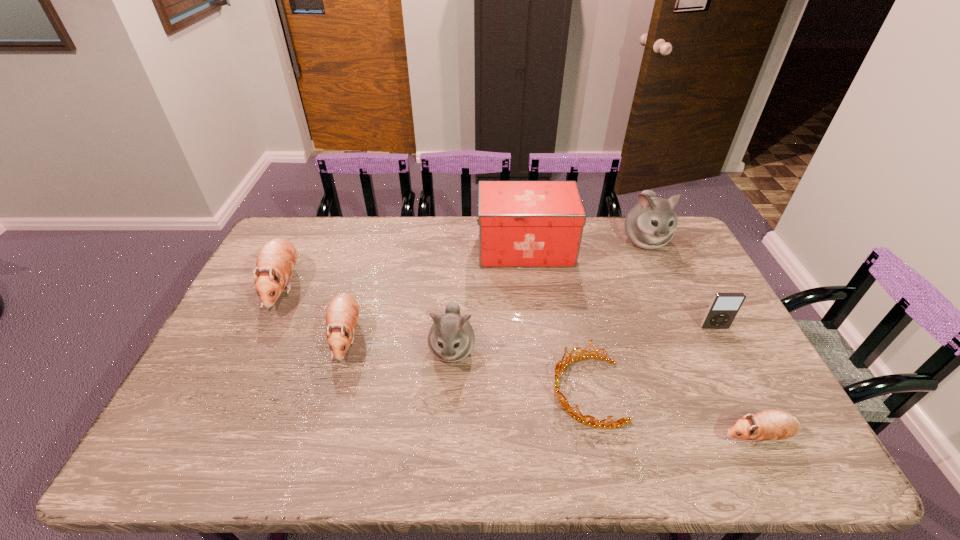
Where is `unoccupied area between the tiara and the farther white hamster`? The image size is (960, 540). unoccupied area between the tiara and the farther white hamster is located at coordinates (615, 315).

The width and height of the screenshot is (960, 540). I want to click on free space that is in between the nearest brown hamster and the second object from left to right, so click(552, 387).

Locate an element on the screen. empty location between the first-aid kit and the second shortest hamster is located at coordinates (436, 293).

This screenshot has height=540, width=960. Find the location of `vacant area between the sixth object from right to left and the first-aid kit`. vacant area between the sixth object from right to left and the first-aid kit is located at coordinates point(489,299).

This screenshot has width=960, height=540. In order to click on free space between the smaller white hamster and the tiara in this screenshot , I will do `click(519, 370)`.

I want to click on vacant space in between the first-aid kit and the biggest brown hamster, so click(404, 268).

This screenshot has height=540, width=960. In order to click on free space between the first-aid kit and the leftmost brown hamster in this screenshot , I will do `click(404, 268)`.

Image resolution: width=960 pixels, height=540 pixels. I want to click on empty space between the leftmost hamster and the third hamster from right to left, so click(x=368, y=318).

The height and width of the screenshot is (540, 960). I want to click on free space between the first-aid kit and the leftmost object, so [404, 268].

Identify which object is located as the nearest to the biggest brown hamster. Please provide its 2D coordinates. Your answer should be formatted as a tuple, i.e. [(x, y)], where the tuple contains the x and y coordinates of a point satisfying the conditions above.

[(342, 313)]